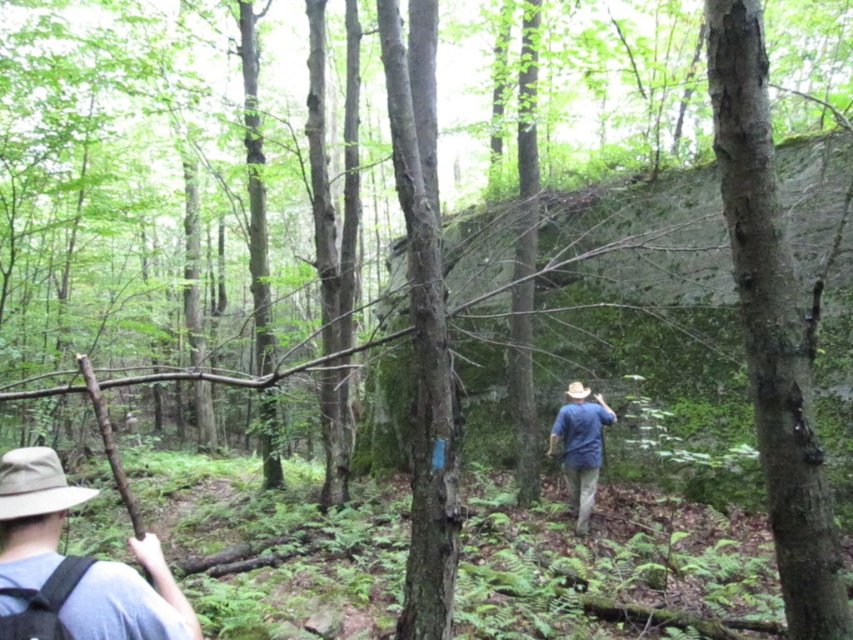
Can you confirm if smooth bark tree at center-right is thinner than blue denim shirt at center?

Yes, smooth bark tree at center-right is thinner than blue denim shirt at center.

Which is behind, point (752, 252) or point (596, 440)?

Positioned behind is point (596, 440).

The width and height of the screenshot is (853, 640). I want to click on smooth bark tree at center-right, so pyautogui.click(x=772, y=326).

Between smooth bark tree at center-right and gray fabric shirt at lower left, which one appears on the left side from the viewer's perspective?

gray fabric shirt at lower left is more to the left.

Does smooth bark tree at center-right appear on the left side of gray fabric shirt at lower left?

Incorrect, smooth bark tree at center-right is not on the left side of gray fabric shirt at lower left.

Does point (809, 488) lie in front of point (44, 577)?

No, it is not.

The height and width of the screenshot is (640, 853). In order to click on smooth bark tree at center-right in this screenshot , I will do `click(772, 326)`.

Between gray fabric shirt at lower left and blue denim shirt at center, which one has more height?

blue denim shirt at center

The height and width of the screenshot is (640, 853). Identify the location of gray fabric shirt at lower left. (129, 600).

Who is more forward, (135, 576) or (589, 465)?

Positioned in front is point (135, 576).

I want to click on gray fabric shirt at lower left, so tap(129, 600).